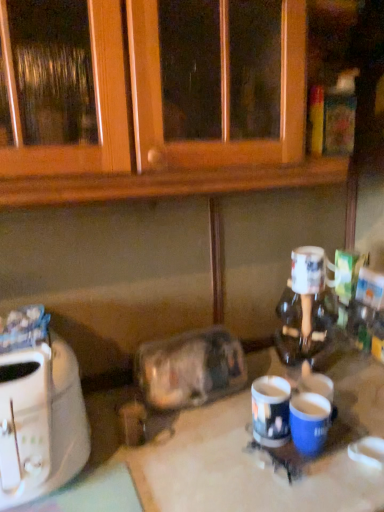
At what (x,y) coordinates should I click in order to perform the action: click on free point above white plastic toaster at left (from a real-world perspective). Please return your answer as a coordinate pair (x, y). Looking at the image, I should click on (27, 353).